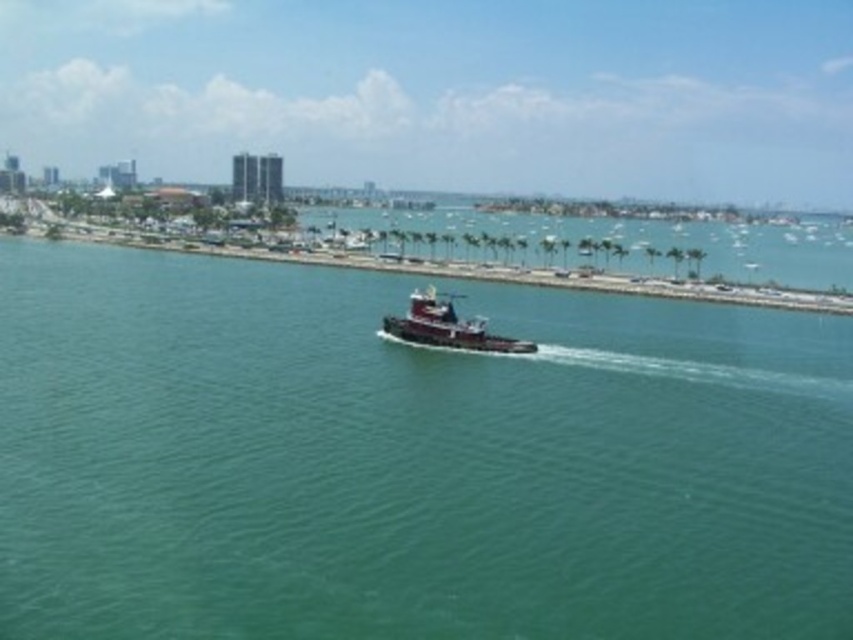
Who is taller, green water at center or shiny black tugboat at center?

green water at center

Does green water at center have a lesser height compared to shiny black tugboat at center?

In fact, green water at center may be taller than shiny black tugboat at center.

The width and height of the screenshot is (853, 640). Identify the location of green water at center. (409, 460).

Where is `green water at center`? The image size is (853, 640). green water at center is located at coordinates (409, 460).